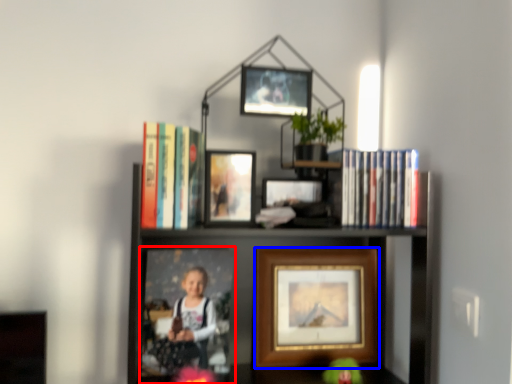
Question: Among these objects, which one is farthest to the camera, picture frame (highlighted by a red box) or picture frame (highlighted by a blue box)?

Choices:
 (A) picture frame
 (B) picture frame

Answer: (B)